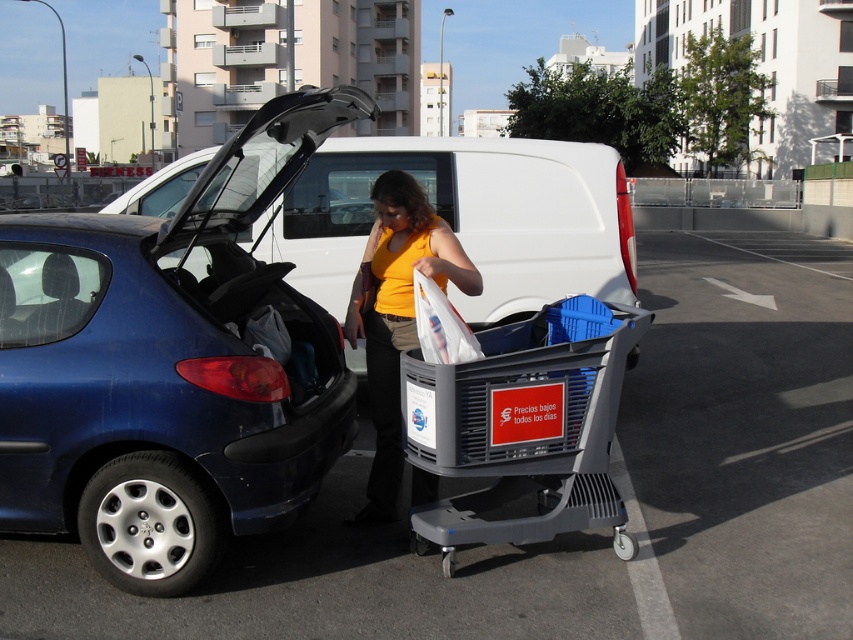
Question: Which point appears farthest from the camera in this image?

Choices:
 (A) (219, 296)
 (B) (578, 192)
 (C) (402, 179)

Answer: (B)

Question: Is white matte van at center further to camera compared to yellow matte shirt at center?

Choices:
 (A) no
 (B) yes

Answer: (B)

Question: Can you confirm if metallic blue car at left is thinner than gray plastic shopping cart at center?

Choices:
 (A) yes
 (B) no

Answer: (B)

Question: Which object is closer to the camera taking this photo?

Choices:
 (A) metallic blue car at left
 (B) gray plastic shopping cart at center
 (C) yellow matte shirt at center
 (D) smooth gray shopping cart at center

Answer: (D)

Question: Which point is farther to the camera?

Choices:
 (A) metallic blue car at left
 (B) white matte van at center
 (C) yellow matte shirt at center
 (D) smooth gray shopping cart at center

Answer: (B)

Question: Is smooth gray shopping cart at center smaller than metallic blue car at left?

Choices:
 (A) no
 (B) yes

Answer: (A)